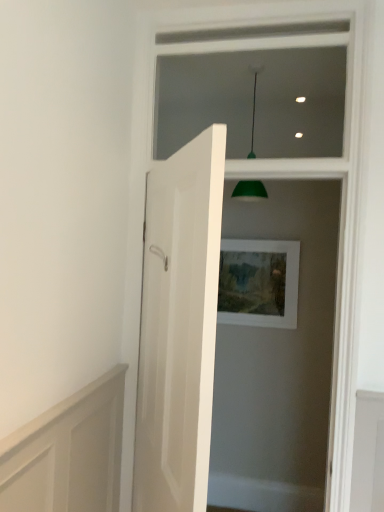
Question: From the image's perspective, is white wood frame at upper center above or below white matte picture frame at center?

Choices:
 (A) above
 (B) below

Answer: (A)

Question: In terms of height, does white wood frame at upper center look taller or shorter compared to white matte picture frame at center?

Choices:
 (A) short
 (B) tall

Answer: (B)

Question: Which object is the closest to the white wood frame at upper center?

Choices:
 (A) green matte lampshade at upper center
 (B) white glossy door at center
 (C) white matte picture frame at center

Answer: (A)

Question: Which is nearer to the white glossy door at center?

Choices:
 (A) white wood frame at upper center
 (B) green matte lampshade at upper center
 (C) white matte picture frame at center

Answer: (B)